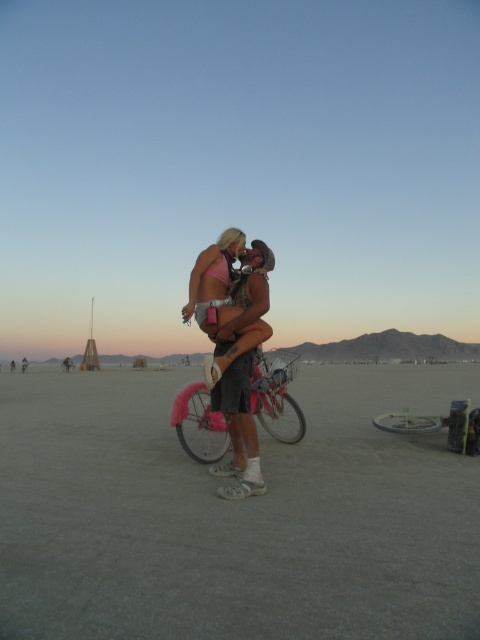
Does point (202, 253) come in front of point (208, 456)?

Yes, it is.

Looking at this image, is the position of pink fabric bikini top at center more distant than that of pink fluffy bicycle at center?

No, it is in front of pink fluffy bicycle at center.

Who is more forward, (x=231, y=470) or (x=299, y=406)?

Point (x=231, y=470) is more forward.

The width and height of the screenshot is (480, 640). I want to click on pink fabric bikini top at center, so click(232, 346).